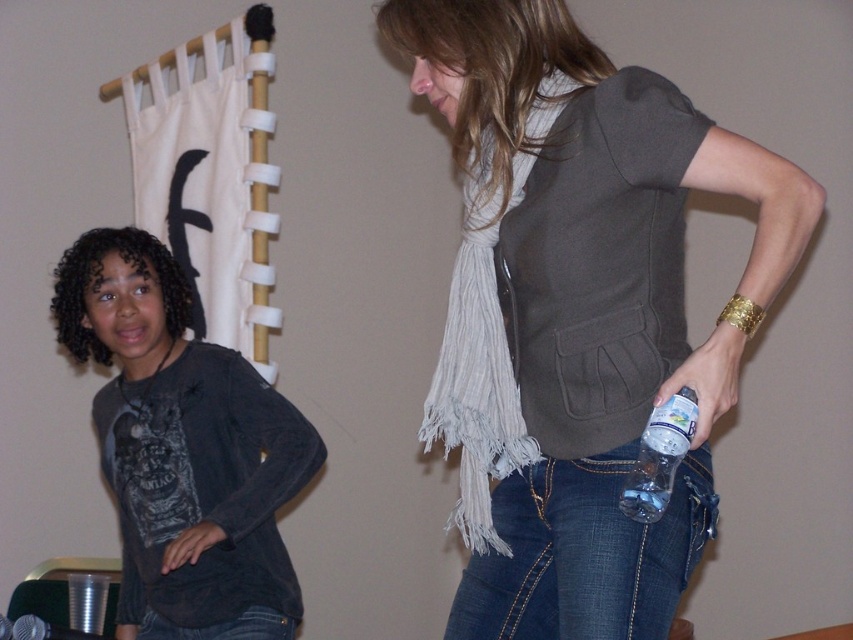
Question: Can you confirm if matte gray scarf at center is positioned below denim at right?

Choices:
 (A) yes
 (B) no

Answer: (B)

Question: Can you confirm if matte gray scarf at center is thinner than clear plastic bottle at lower right?

Choices:
 (A) yes
 (B) no

Answer: (B)

Question: Is matte gray scarf at center smaller than clear plastic bottle at lower right?

Choices:
 (A) yes
 (B) no

Answer: (B)

Question: Which object appears closest to the camera in this image?

Choices:
 (A) jeans at lower center
 (B) dark gray cotton shirt at center
 (C) clear plastic bottle at lower right
 (D) matte gray scarf at center

Answer: (D)

Question: Which point appears farthest from the camera in this image?

Choices:
 (A) (526, 616)
 (B) (683, 397)
 (C) (286, 618)

Answer: (C)

Question: Which of the following is the closest to the observer?

Choices:
 (A) clear plastic bottle at lower right
 (B) dark gray cotton shirt at center
 (C) denim at right

Answer: (A)